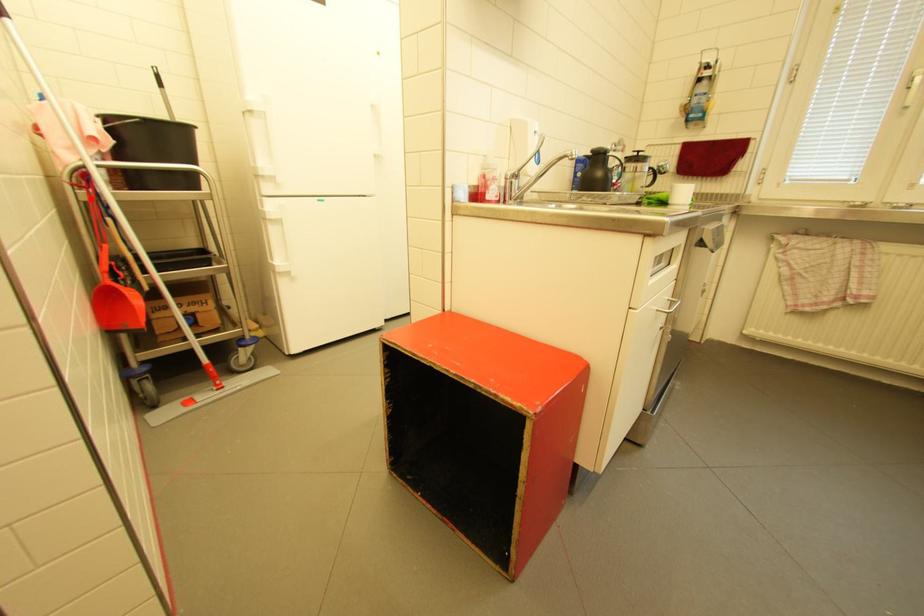
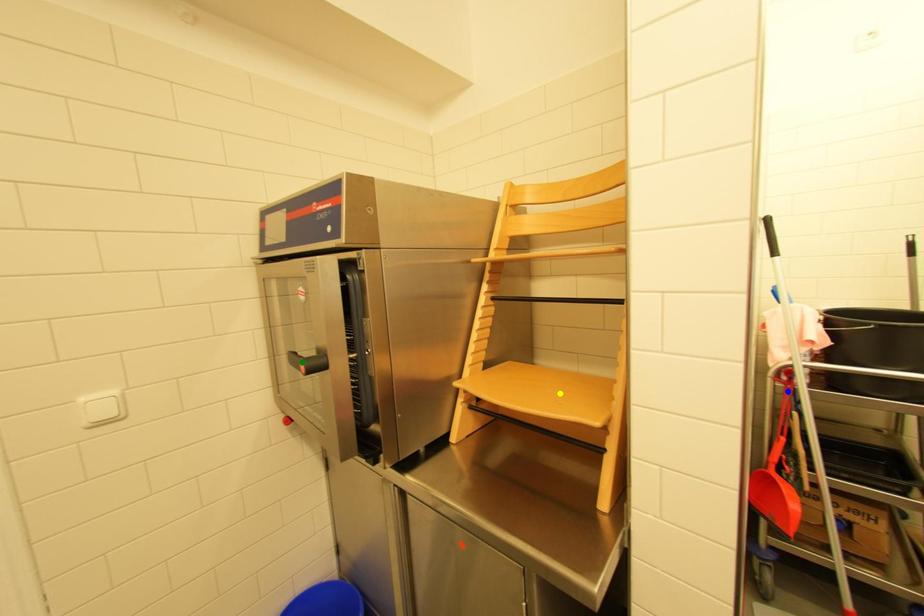
Question: I am providing you with two images of the same scene from different viewpoints. A red point is marked on the first image. You are given multiple points on the second image. Which point in image 2 represents the same 3d spot as the red point in image 1?

Choices:
 (A) blue point
 (B) yellow point
 (C) green point

Answer: (A)